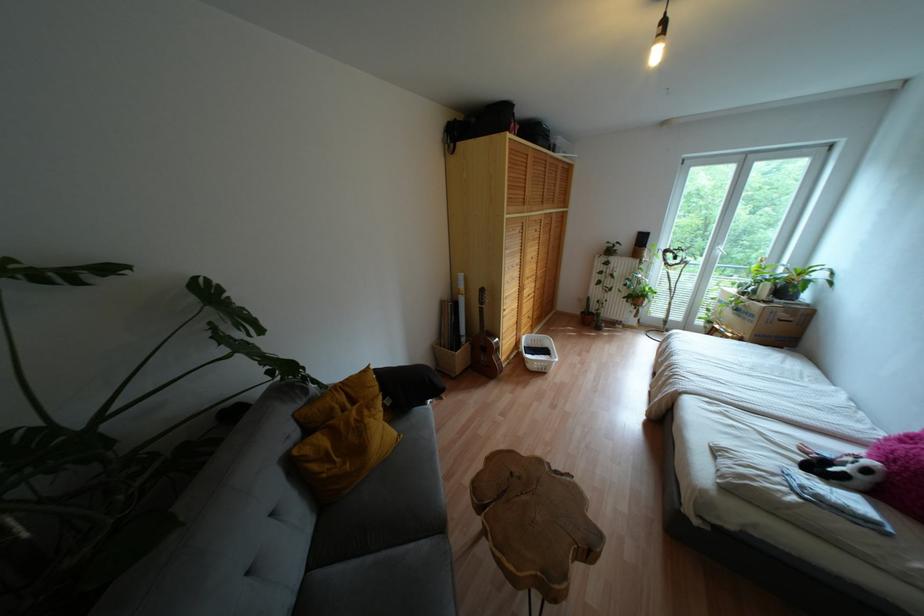
Where would you lift the white laundry basket? Please return your answer as a coordinate pair (x, y).

(538, 352)